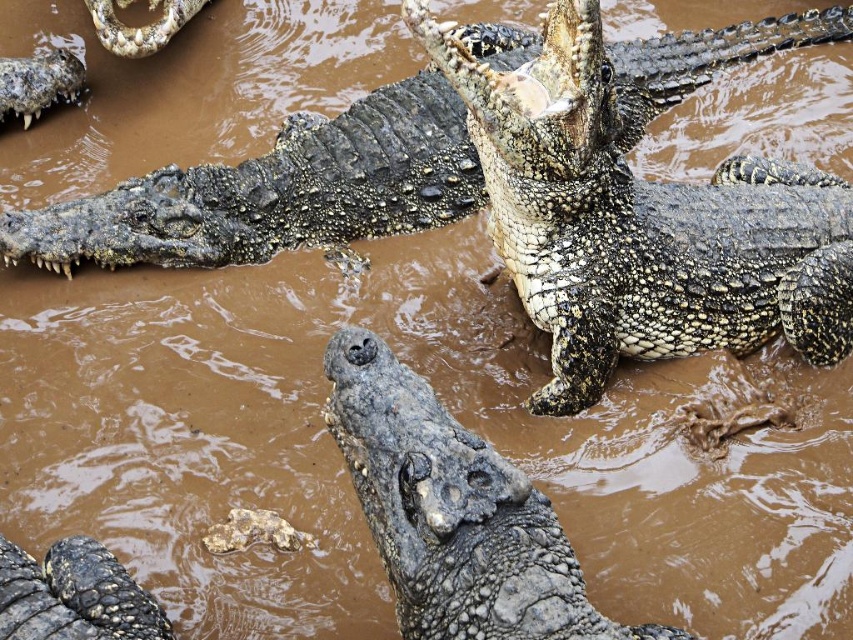
Which is behind, point (846, 332) or point (15, 579)?

The point (846, 332) is behind.

Is rough scaly crocodile at upper right closer to the viewer compared to dark gray scaly head at lower left?

No, it is behind dark gray scaly head at lower left.

Locate an element on the screen. rough scaly crocodile at upper right is located at coordinates (646, 205).

In order to click on rough scaly crocodile at upper right in this screenshot , I will do `click(646, 205)`.

Which is behind, point (685, 268) or point (225, 259)?

Positioned behind is point (225, 259).

What do you see at coordinates (646, 205) in the screenshot? The image size is (853, 640). I see `rough scaly crocodile at upper right` at bounding box center [646, 205].

This screenshot has width=853, height=640. I want to click on rough scaly crocodile at upper right, so click(646, 205).

Can you confirm if rough scaly crocodile at upper right is positioned to the right of rough textured crocodile at center?

Indeed, rough scaly crocodile at upper right is positioned on the right side of rough textured crocodile at center.

Which is behind, point (519, 74) or point (482, 612)?

Point (519, 74)

Identify the location of rough scaly crocodile at upper right. (646, 205).